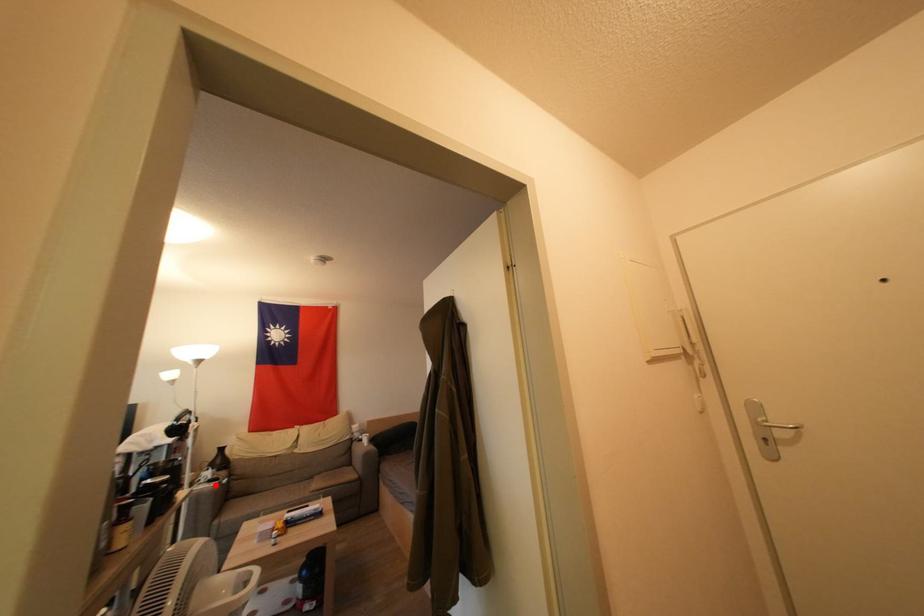
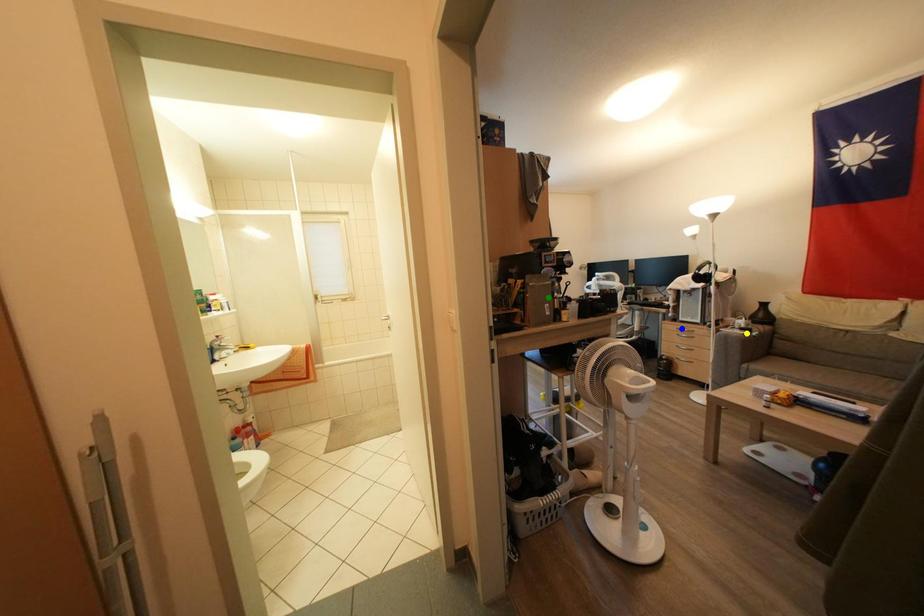
Question: I am providing you with two images of the same scene from different viewpoints. A red point is marked on the first image. You are given multiple points on the second image. Which spot in image 2 lines up with the point in image 1?

Choices:
 (A) green point
 (B) yellow point
 (C) blue point

Answer: (B)